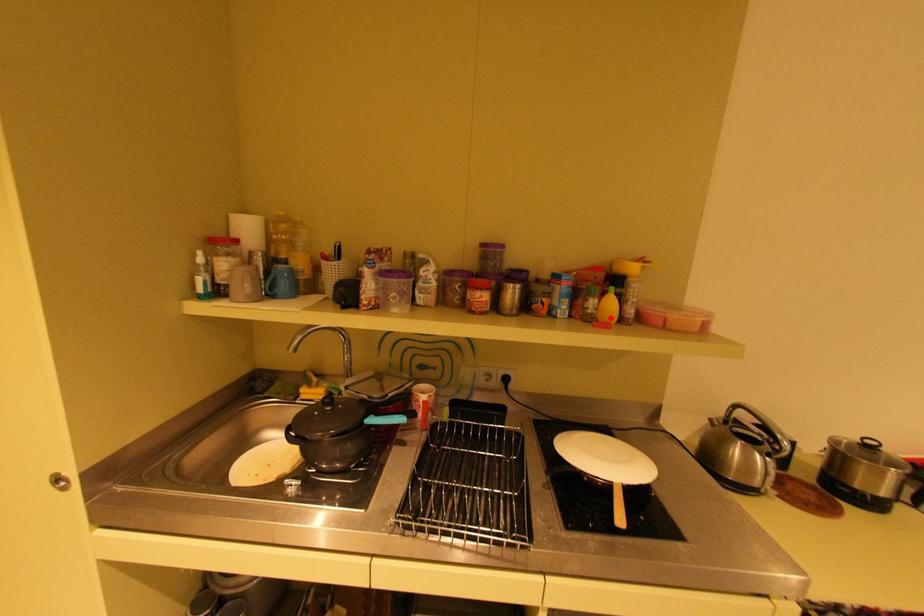
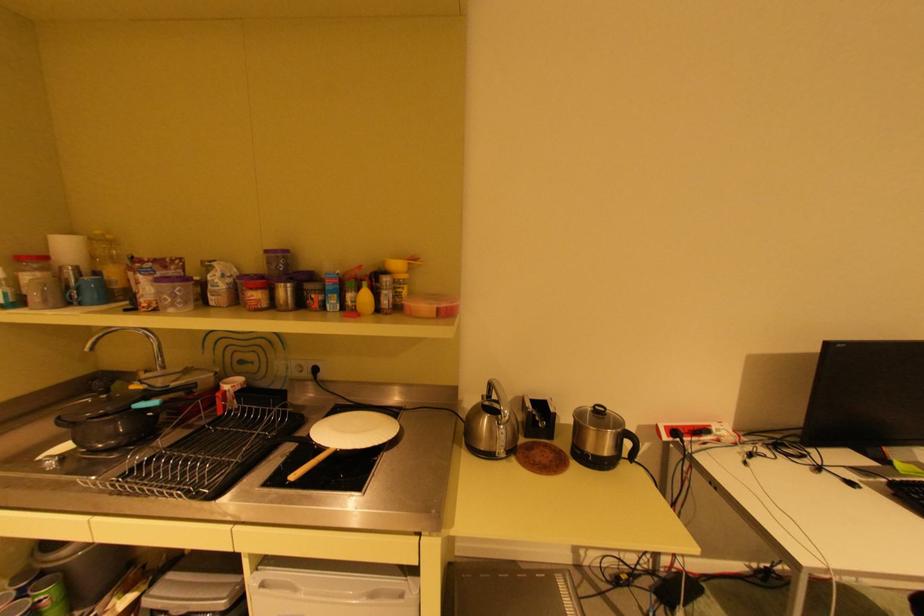
The point at the highlighted location is marked in the first image. Where is the corresponding point in the second image?

(367, 309)